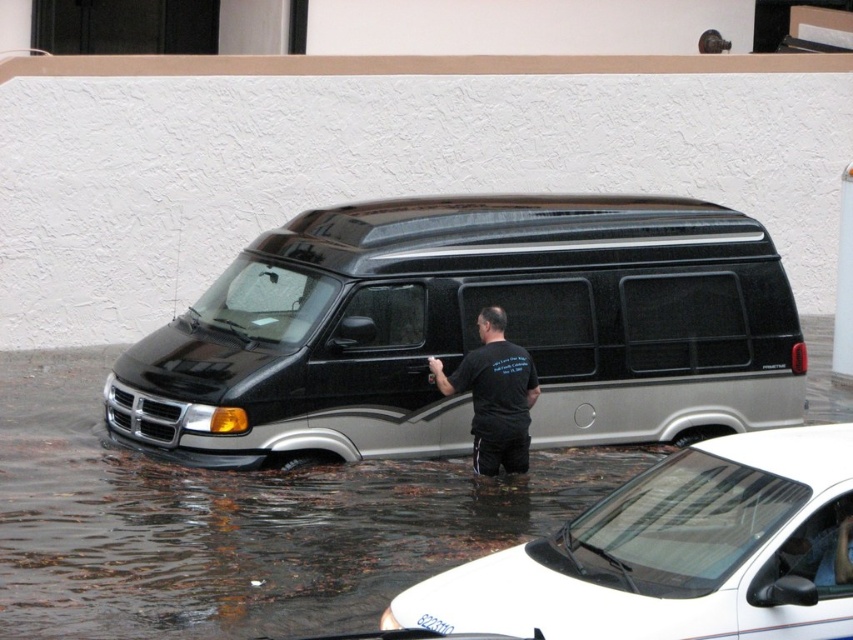
Is point (473, 593) positioned behind point (486, 449)?

No, it is in front of (486, 449).

Is white glossy car at lower center further to camera compared to black matte shirt at center?

No, white glossy car at lower center is closer to the viewer.

Identify the location of white glossy car at lower center. (675, 554).

This screenshot has height=640, width=853. I want to click on white glossy car at lower center, so click(675, 554).

Is black metallic van at center further to camera compared to black matte shirt at center?

No, black metallic van at center is in front of black matte shirt at center.

Is black metallic van at center closer to camera compared to black matte shirt at center?

Yes.

Identify the location of black metallic van at center. (469, 330).

Can you confirm if black metallic van at center is smaller than white glossy car at lower center?

No, black metallic van at center is not smaller than white glossy car at lower center.

At what (x,y) coordinates should I click in order to perform the action: click on black metallic van at center. Please return your answer as a coordinate pair (x, y). Looking at the image, I should click on (469, 330).

This screenshot has height=640, width=853. What do you see at coordinates (469, 330) in the screenshot?
I see `black metallic van at center` at bounding box center [469, 330].

Locate an element on the screen. black metallic van at center is located at coordinates (469, 330).